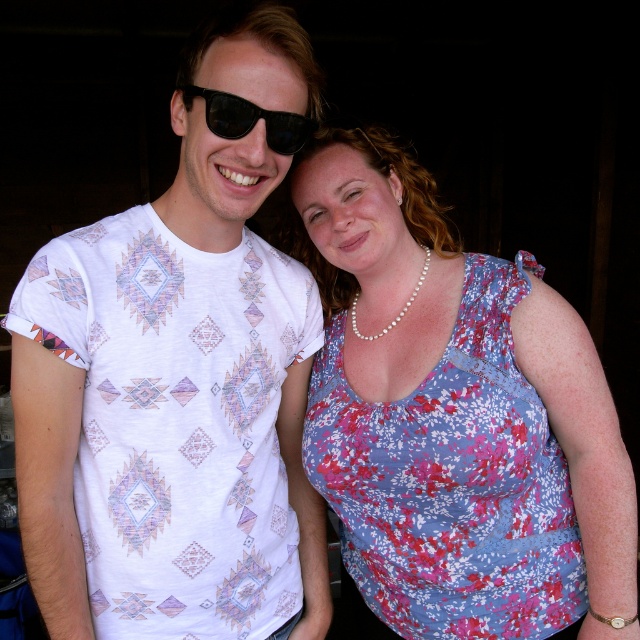
Question: Can you confirm if floral print fabric dress at right is positioned to the left of black reflective sunglasses at upper center?

Choices:
 (A) yes
 (B) no

Answer: (B)

Question: Which point is farther from the camera taking this photo?

Choices:
 (A) (188, 352)
 (B) (211, 129)

Answer: (A)

Question: Which is nearer to the white printed t-shirt at center?

Choices:
 (A) black reflective sunglasses at upper center
 (B) floral print fabric dress at right

Answer: (B)

Question: Can you confirm if white printed t-shirt at center is positioned to the right of floral print fabric dress at right?

Choices:
 (A) no
 (B) yes

Answer: (A)

Question: Can you confirm if white printed t-shirt at center is thinner than floral print fabric dress at right?

Choices:
 (A) no
 (B) yes

Answer: (B)

Question: Which object appears farthest from the camera in this image?

Choices:
 (A) floral print fabric dress at right
 (B) white printed t-shirt at center
 (C) black reflective sunglasses at upper center

Answer: (A)